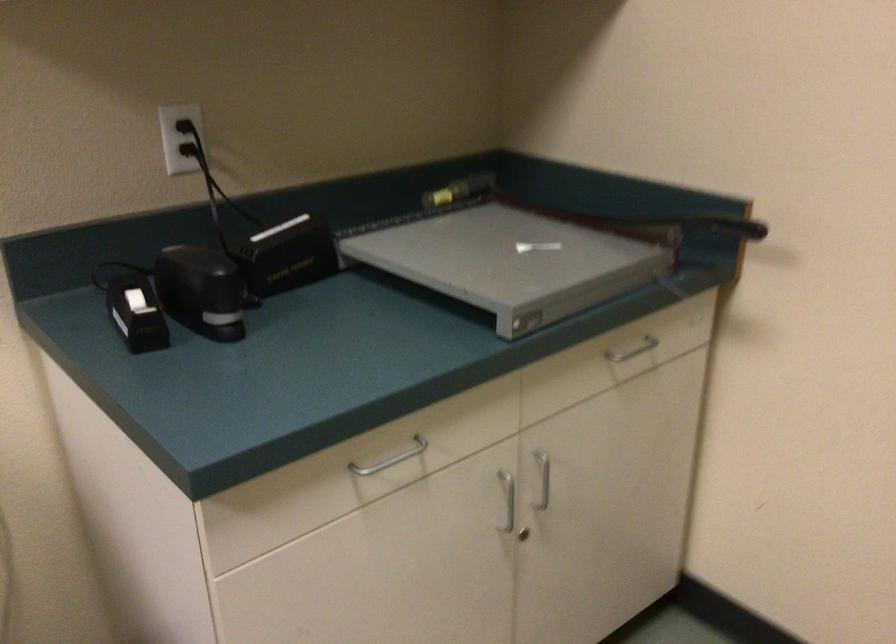
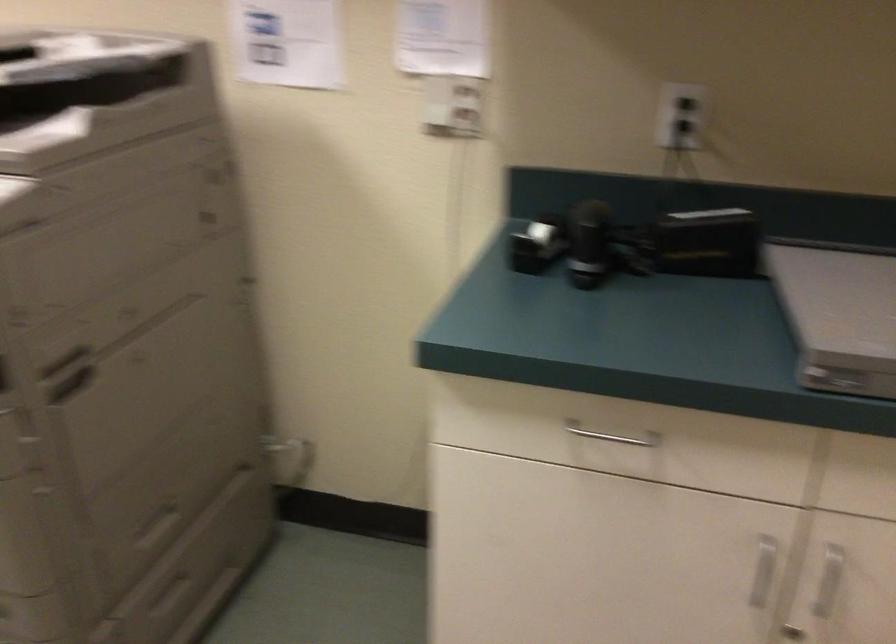
Question: The camera is either moving clockwise (left) or counter-clockwise (right) around the object. The first image is from the beginning of the video and the second image is from the end. Is the camera moving left or right when shooting the video?

Choices:
 (A) Left
 (B) Right

Answer: (B)